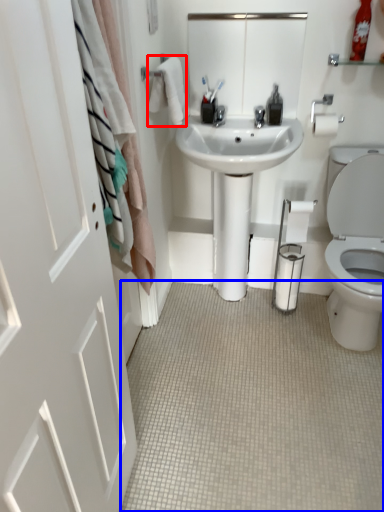
Question: Among these objects, which one is farthest to the camera, bath towel (highlighted by a red box) or plain (highlighted by a blue box)?

Choices:
 (A) bath towel
 (B) plain

Answer: (A)